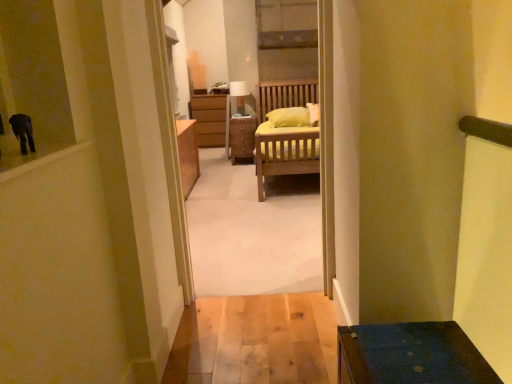
Question: From the image's perspective, is matte white lamp at center above or below wooden bed at center?

Choices:
 (A) below
 (B) above

Answer: (B)

Question: From a real-world perspective, is matte white lamp at center physically located above or below wooden bed at center?

Choices:
 (A) above
 (B) below

Answer: (A)

Question: Which of these objects is positioned farthest from the matte white lamp at center?

Choices:
 (A) wooden bed at center
 (B) wooden nightstand at center

Answer: (A)

Question: Based on their relative distances, which object is nearer to the wooden nightstand at center?

Choices:
 (A) wooden bed at center
 (B) matte white lamp at center

Answer: (B)